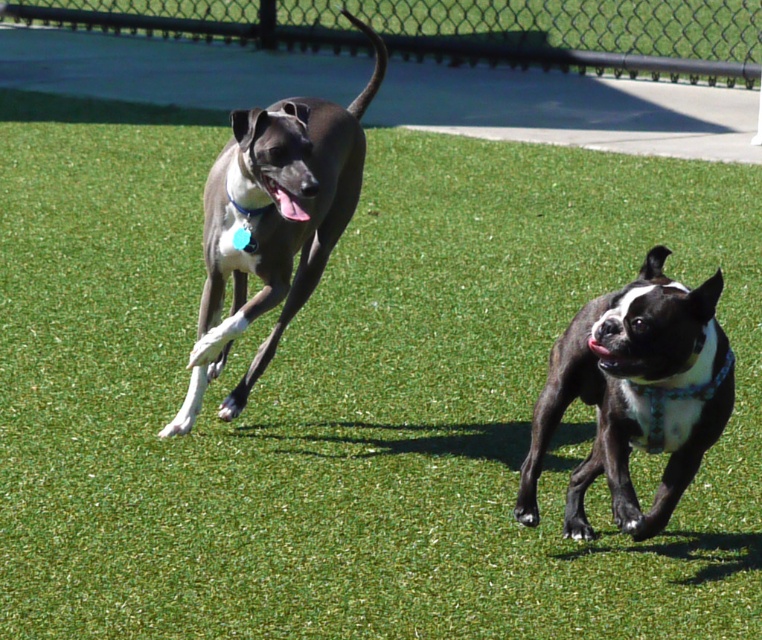
You are a dog owner who wants to ensure your pet stays within a safe area. The green artificial turf at upper center is the designated play zone, and the black glossy mouth at lower right is your dog. How far apart are these two objects?

The distance between the green artificial turf at upper center and the black glossy mouth at lower right is 47.54 feet.

Looking at this image, you are standing at the point labeled point (578, 33). What type of surface are you currently standing on?

The point (578, 33) is on green artificial turf at upper center.

You are a photographer trying to capture a closeup of the black glossy mouth at lower right. However, the green artificial turf at upper center is blocking your view. Can you move the turf to get a clear shot?

The black glossy mouth at lower right is behind the green artificial turf at upper center, so moving the turf would allow you to see the black glossy mouth at lower right.